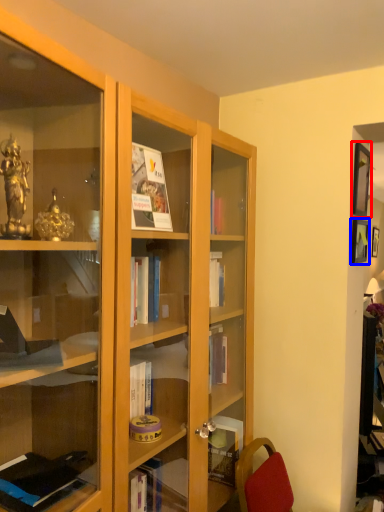
Question: Which object is further to the camera taking this photo, picture frame (highlighted by a red box) or picture frame (highlighted by a blue box)?

Choices:
 (A) picture frame
 (B) picture frame

Answer: (B)